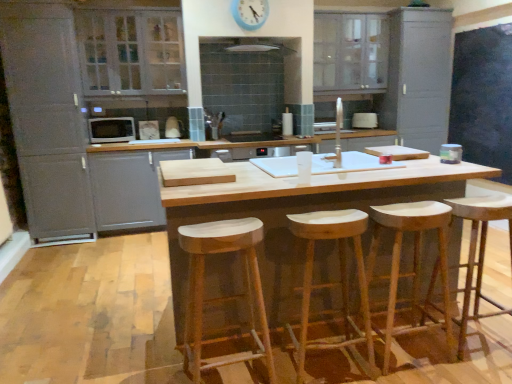
The image size is (512, 384). Describe the element at coordinates (298, 213) in the screenshot. I see `natural wood counter at center` at that location.

What is the approximate width of white glossy toaster at center, which is counted as the second appliance, starting from the front?

white glossy toaster at center, which is counted as the second appliance, starting from the front, is 5.23 inches in width.

Identify the location of white glossy toaster at center, which is counted as the second appliance, starting from the front. This screenshot has width=512, height=384. (364, 121).

What do you see at coordinates (129, 187) in the screenshot? I see `matte gray cabinet at left, arranged as the 3th cabinetry when viewed from the left` at bounding box center [129, 187].

Image resolution: width=512 pixels, height=384 pixels. In order to click on matte gray cabinet at upper center, arranged as the 2th cabinetry when viewed from the right in this screenshot , I will do `click(350, 51)`.

The height and width of the screenshot is (384, 512). Find the location of `natural wood counter at center`. natural wood counter at center is located at coordinates (298, 213).

Is matte gray cabinet at left, which is counted as the 1th cabinetry, starting from the left, bigger than matte gray cabinet at upper center, arranged as the 4th cabinetry when viewed from the left?

Indeed, matte gray cabinet at left, which is counted as the 1th cabinetry, starting from the left, has a larger size compared to matte gray cabinet at upper center, arranged as the 4th cabinetry when viewed from the left.

Is matte gray cabinet at left, which is counted as the 1th cabinetry, starting from the left, taller than matte gray cabinet at upper center, arranged as the 2th cabinetry when viewed from the right?

Yes, matte gray cabinet at left, which is counted as the 1th cabinetry, starting from the left, is taller than matte gray cabinet at upper center, arranged as the 2th cabinetry when viewed from the right.

Would you consider matte gray cabinet at left, which is counted as the 5th cabinetry, starting from the right, to be distant from matte gray cabinet at upper center, arranged as the 2th cabinetry when viewed from the right?

matte gray cabinet at left, which is counted as the 5th cabinetry, starting from the right, is positioned a significant distance from matte gray cabinet at upper center, arranged as the 2th cabinetry when viewed from the right.

Starting from the matte gray cabinet at upper center, arranged as the 2th cabinetry when viewed from the right, which cabinetry is the 3rd one to the left? Please provide its 2D coordinates.

[(88, 111)]

From the image's perspective, is natural wood stool at center, arranged as the 1th stool when viewed from the right, on top of natural wood stool at center, the second stool viewed from the left?

Yes, from the image's perspective, natural wood stool at center, arranged as the 1th stool when viewed from the right, is above natural wood stool at center, the second stool viewed from the left.

Is natural wood stool at center, arranged as the 1th stool when viewed from the right, wider than natural wood stool at center, the 2th stool from the right?

No.

Is natural wood stool at center, arranged as the 1th stool when viewed from the right, inside the boundaries of natural wood stool at center, the second stool viewed from the left, or outside?

natural wood stool at center, arranged as the 1th stool when viewed from the right, lies outside natural wood stool at center, the second stool viewed from the left.

Is the depth of white glass cabinet at upper left, which appears as the 4th cabinetry when viewed from the right, greater than that of white glossy toaster at center, which is counted as the second appliance, starting from the front?

No, the depth of white glass cabinet at upper left, which appears as the 4th cabinetry when viewed from the right, is less than that of white glossy toaster at center, which is counted as the second appliance, starting from the front.

Is white glass cabinet at upper left, which appears as the 4th cabinetry when viewed from the right, spatially inside white glossy toaster at center, which is the first appliance in right-to-left order, or outside of it?

white glass cabinet at upper left, which appears as the 4th cabinetry when viewed from the right, is not enclosed by white glossy toaster at center, which is the first appliance in right-to-left order.

Could you tell me if white glass cabinet at upper left, which appears as the 4th cabinetry when viewed from the right, is facing white glossy toaster at center, acting as the 2th appliance starting from the left?

No, white glass cabinet at upper left, which appears as the 4th cabinetry when viewed from the right, does not turn towards white glossy toaster at center, acting as the 2th appliance starting from the left.

Between white glass cabinet at upper left, which is the second cabinetry from left to right, and white glossy toaster at center, marked as the 1th appliance in a back-to-front arrangement, which one has smaller width?

white glossy toaster at center, marked as the 1th appliance in a back-to-front arrangement.

Considering the sizes of objects white glass cabinet at upper left, which appears as the 4th cabinetry when viewed from the right, and white wood stool at center, the 1th stool from the left, in the image provided, who is wider, white glass cabinet at upper left, which appears as the 4th cabinetry when viewed from the right, or white wood stool at center, the 1th stool from the left,?

With larger width is white glass cabinet at upper left, which appears as the 4th cabinetry when viewed from the right.

Measure the distance between white glass cabinet at upper left, which is the second cabinetry from left to right, and white wood stool at center, the 1th stool from the left.

A distance of 9.08 feet exists between white glass cabinet at upper left, which is the second cabinetry from left to right, and white wood stool at center, the 1th stool from the left.

In the image, is white glass cabinet at upper left, which is the second cabinetry from left to right, on the left side or the right side of white wood stool at center, the 1th stool from the left?

From the image, it's evident that white glass cabinet at upper left, which is the second cabinetry from left to right, is to the left of white wood stool at center, the 1th stool from the left.

Consider the image. Is white wood stool at center, the 1th stool from the left, at the back of white glass cabinet at upper left, which is the second cabinetry from left to right?

white glass cabinet at upper left, which is the second cabinetry from left to right, does not have its back to white wood stool at center, the 1th stool from the left.

From the image's perspective, which is above, matte gray cabinet at upper center, arranged as the 2th cabinetry when viewed from the right, or matte gray cabinet at left, arranged as the 3th cabinetry when viewed from the left?

matte gray cabinet at upper center, arranged as the 2th cabinetry when viewed from the right, appears higher in the image.

How many degrees apart are the facing directions of matte gray cabinet at upper center, arranged as the 2th cabinetry when viewed from the right, and matte gray cabinet at left, marked as the third cabinetry in a right-to-left arrangement?

The angular difference between matte gray cabinet at upper center, arranged as the 2th cabinetry when viewed from the right, and matte gray cabinet at left, marked as the third cabinetry in a right-to-left arrangement, is 0.332 degrees.

Which is behind, point (378, 19) or point (150, 226)?

Point (378, 19)

Is matte gray cabinet at upper center, arranged as the 4th cabinetry when viewed from the left, taller or shorter than matte gray cabinet at left, arranged as the 3th cabinetry when viewed from the left?

In the image, matte gray cabinet at upper center, arranged as the 4th cabinetry when viewed from the left, appears to be shorter than matte gray cabinet at left, arranged as the 3th cabinetry when viewed from the left.

From the image's perspective, which is above, white wood stool at center, placed as the 3th stool when sorted from right to left, or blue plastic clock at upper center?

From the image's view, blue plastic clock at upper center is above.

Is blue plastic clock at upper center a part of white wood stool at center, placed as the 3th stool when sorted from right to left?

No, white wood stool at center, placed as the 3th stool when sorted from right to left, does not contain blue plastic clock at upper center.

Are white wood stool at center, the 1th stool from the left, and blue plastic clock at upper center beside each other?

white wood stool at center, the 1th stool from the left, is not next to blue plastic clock at upper center, and they're not touching.

Where is `clock lying behind the white wood stool at center, placed as the 3th stool when sorted from right to left`? This screenshot has height=384, width=512. clock lying behind the white wood stool at center, placed as the 3th stool when sorted from right to left is located at coordinates (250, 13).

From a real-world perspective, who is located lower, natural wood stool at center, arranged as the 1th stool when viewed from the right, or matte gray cabinet at upper right, placed as the first cabinetry when sorted from right to left?

natural wood stool at center, arranged as the 1th stool when viewed from the right.

Which of these two, natural wood stool at center, arranged as the 1th stool when viewed from the right, or matte gray cabinet at upper right, the fifth cabinetry when ordered from left to right, is wider?

Wider between the two is matte gray cabinet at upper right, the fifth cabinetry when ordered from left to right.

Consider the image. Considering the sizes of natural wood stool at center, arranged as the 1th stool when viewed from the right, and matte gray cabinet at upper right, the fifth cabinetry when ordered from left to right, in the image, is natural wood stool at center, arranged as the 1th stool when viewed from the right, taller or shorter than matte gray cabinet at upper right, the fifth cabinetry when ordered from left to right,?

Clearly, natural wood stool at center, arranged as the 1th stool when viewed from the right, is shorter compared to matte gray cabinet at upper right, the fifth cabinetry when ordered from left to right.

Which is correct: natural wood stool at center, which is the third stool from left to right, is inside matte gray cabinet at upper right, placed as the first cabinetry when sorted from right to left, or outside of it?

natural wood stool at center, which is the third stool from left to right, cannot be found inside matte gray cabinet at upper right, placed as the first cabinetry when sorted from right to left.

Starting from the matte gray cabinet at left, which is counted as the 1th cabinetry, starting from the left, which cabinetry is the 3rd one to the right? Please provide its 2D coordinates.

[(350, 51)]

Starting from the natural wood stool at center, which is the third stool from left to right, which stool is the 1st one to the left? Please provide its 2D coordinates.

[(333, 283)]

When comparing their distances from matte gray cabinet at upper center, arranged as the 2th cabinetry when viewed from the right, does natural wood stool at center, which is the third stool from left to right, or natural wood counter at center seem closer?

Answer: The object closer to matte gray cabinet at upper center, arranged as the 2th cabinetry when viewed from the right, is natural wood counter at center.

Consider the image. Which object lies nearer to the anchor point blue plastic clock at upper center, natural wood stool at center, which is the third stool from left to right, or matte gray cabinet at left, marked as the third cabinetry in a right-to-left arrangement?

matte gray cabinet at left, marked as the third cabinetry in a right-to-left arrangement, is positioned closer to the anchor blue plastic clock at upper center.

Estimate the real-world distances between objects in this image. Which object is further from natural wood cutting board at center, matte gray cabinet at upper right, the fifth cabinetry when ordered from left to right, or white glossy microwave at left, which is the second appliance from right to left?

Among the two, matte gray cabinet at upper right, the fifth cabinetry when ordered from left to right, is located further to natural wood cutting board at center.

Based on their spatial positions, is natural wood stool at center, arranged as the 1th stool when viewed from the right, or white glossy toaster at center, acting as the 2th appliance starting from the left, further from white glossy microwave at left, which is the 2th appliance from back to front?

Among the two, natural wood stool at center, arranged as the 1th stool when viewed from the right, is located further to white glossy microwave at left, which is the 2th appliance from back to front.

From the picture: Estimate the real-world distances between objects in this image. Which object is further from white glossy exhaust hood at upper center, matte gray cabinet at left, arranged as the 3th cabinetry when viewed from the left, or white glass cabinet at upper left, which appears as the 4th cabinetry when viewed from the right?

matte gray cabinet at left, arranged as the 3th cabinetry when viewed from the left.

Estimate the real-world distances between objects in this image. Which object is further from matte gray cabinet at upper right, placed as the first cabinetry when sorted from right to left, natural wood stool at center, the second stool viewed from the left, or natural wood stool at center, which is the third stool from left to right?

natural wood stool at center, the second stool viewed from the left, is further to matte gray cabinet at upper right, placed as the first cabinetry when sorted from right to left.

Based on their spatial positions, is natural wood cutting board at center or white glossy microwave at left, which is the 2th appliance from back to front, further from matte gray cabinet at upper center, arranged as the 4th cabinetry when viewed from the left?

natural wood cutting board at center is further to matte gray cabinet at upper center, arranged as the 4th cabinetry when viewed from the left.

From the image, which object appears to be nearer to matte gray cabinet at upper right, placed as the first cabinetry when sorted from right to left, white glass cabinet at upper left, which is the second cabinetry from left to right, or natural wood counter at center?

white glass cabinet at upper left, which is the second cabinetry from left to right, lies closer to matte gray cabinet at upper right, placed as the first cabinetry when sorted from right to left, than the other object.

Locate an element on the screen. The image size is (512, 384). counter between natural wood stool at center, the 2th stool from the right, and white glossy exhaust hood at upper center in the front-back direction is located at coordinates (298, 213).

The width and height of the screenshot is (512, 384). In order to click on exhaust hood positioned between natural wood counter at center and matte gray cabinet at upper center, arranged as the 4th cabinetry when viewed from the left, from near to far in this screenshot , I will do `click(249, 46)`.

The width and height of the screenshot is (512, 384). In order to click on counter between white wood stool at center, placed as the 3th stool when sorted from right to left, and white glossy microwave at left, which is the second appliance from right to left, from front to back in this screenshot , I will do `click(298, 213)`.

Where is `exhaust hood situated between white glossy microwave at left, which appears as the first appliance when viewed from the front, and blue plastic clock at upper center from left to right`? The width and height of the screenshot is (512, 384). exhaust hood situated between white glossy microwave at left, which appears as the first appliance when viewed from the front, and blue plastic clock at upper center from left to right is located at coordinates (249, 46).